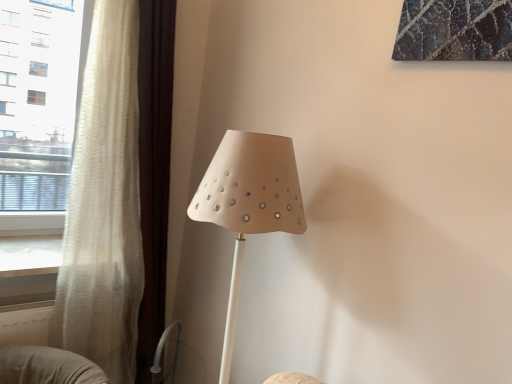
Question: Does white sheer curtain at left lie in front of matte beige lampshade at center?

Choices:
 (A) no
 (B) yes

Answer: (A)

Question: Is white sheer curtain at left in contact with matte beige lampshade at center?

Choices:
 (A) yes
 (B) no

Answer: (B)

Question: Can you confirm if white sheer curtain at left is taller than matte beige lampshade at center?

Choices:
 (A) yes
 (B) no

Answer: (A)

Question: From the image's perspective, would you say white sheer curtain at left is shown under matte beige lampshade at center?

Choices:
 (A) no
 (B) yes

Answer: (A)

Question: Could you tell me if white sheer curtain at left is turned towards matte beige lampshade at center?

Choices:
 (A) yes
 (B) no

Answer: (A)

Question: Considering the relative positions of white sheer curtain at left and matte beige lampshade at center in the image provided, is white sheer curtain at left to the left of matte beige lampshade at center from the viewer's perspective?

Choices:
 (A) no
 (B) yes

Answer: (B)

Question: Is white textured curtain at left outside white sheer curtain at left?

Choices:
 (A) yes
 (B) no

Answer: (A)

Question: Is white textured curtain at left not near white sheer curtain at left?

Choices:
 (A) no
 (B) yes

Answer: (A)

Question: Is white textured curtain at left turned away from white sheer curtain at left?

Choices:
 (A) yes
 (B) no

Answer: (A)

Question: From a real-world perspective, is white textured curtain at left physically above white sheer curtain at left?

Choices:
 (A) no
 (B) yes

Answer: (A)

Question: Does white textured curtain at left have a greater height compared to white sheer curtain at left?

Choices:
 (A) yes
 (B) no

Answer: (A)

Question: Is white textured curtain at left to the right of white sheer curtain at left from the viewer's perspective?

Choices:
 (A) yes
 (B) no

Answer: (A)

Question: Is matte beige lampshade at center outside of white sheer curtain at left?

Choices:
 (A) yes
 (B) no

Answer: (A)